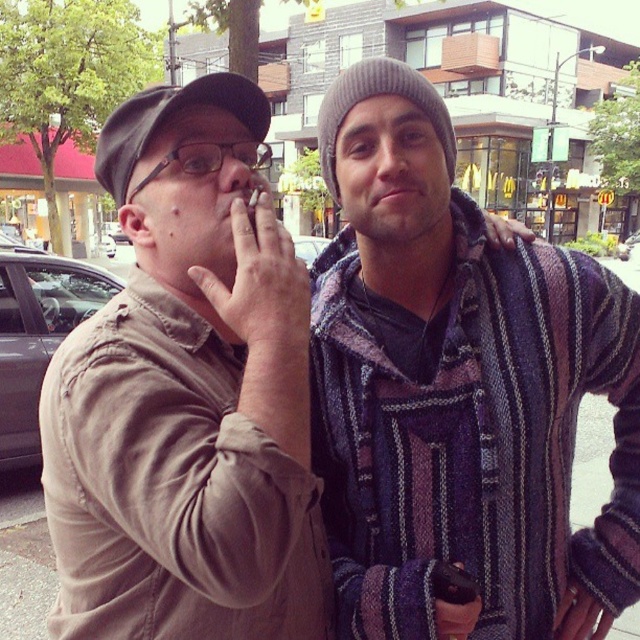
Does striped woolen sweater at center have a lesser height compared to matte khaki shirt at center?

No.

Who is positioned more to the left, striped woolen sweater at center or matte khaki shirt at center?

From the viewer's perspective, matte khaki shirt at center appears more on the left side.

Identify the location of striped woolen sweater at center. This screenshot has width=640, height=640. (458, 390).

Locate an element on the screen. This screenshot has width=640, height=640. striped woolen sweater at center is located at coordinates (458, 390).